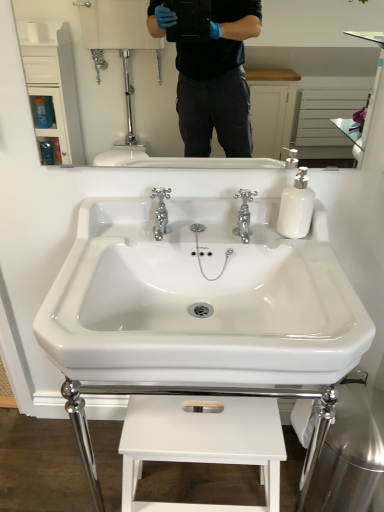
Locate an element on the screen. vacant area on top of white matte stool at lower center (from a real-world perspective) is located at coordinates (195, 421).